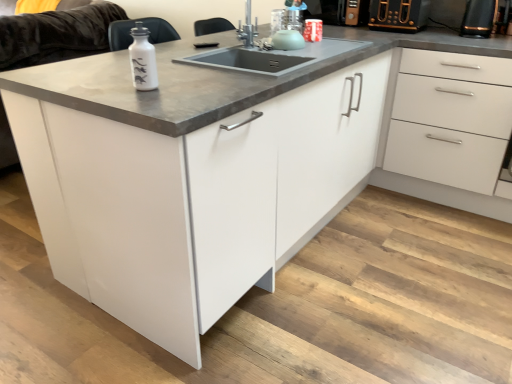
The width and height of the screenshot is (512, 384). What do you see at coordinates (194, 198) in the screenshot? I see `white glossy cabinet at center` at bounding box center [194, 198].

In order to face white glossy bottle at upper left, should I rotate leftwards or rightwards?

You should rotate left by 15.250 degrees.

What is the approximate height of white glossy bottle at upper left?

7.27 inches.

The width and height of the screenshot is (512, 384). I want to click on black plastic toaster at upper right, which is counted as the 2th appliance, starting from the left, so click(x=478, y=18).

In the scene shown: From a real-world perspective, which object rests below the other?

white glossy drawer at right is physically lower.

Based on the photo, considering the sizes of objects white glossy bottle at upper left and white glossy drawer at right in the image provided, who is smaller, white glossy bottle at upper left or white glossy drawer at right?

Smaller between the two is white glossy bottle at upper left.

Is white glossy bottle at upper left situated inside white glossy drawer at right or outside?

white glossy bottle at upper left is outside white glossy drawer at right.

Could you tell me if white glossy bottle at upper left is turned towards white glossy drawer at right?

No, white glossy bottle at upper left does not turn towards white glossy drawer at right.

Considering the relative sizes of white matte couch at upper left and satin nickel faucet at upper center in the image provided, is white matte couch at upper left thinner than satin nickel faucet at upper center?

In fact, white matte couch at upper left might be wider than satin nickel faucet at upper center.

Identify the location of faucet that appears below the white matte couch at upper left (from the image's perspective). Image resolution: width=512 pixels, height=384 pixels. (247, 28).

Is white matte couch at upper left facing towards satin nickel faucet at upper center?

No, white matte couch at upper left is not turned towards satin nickel faucet at upper center.

Consider the image. Who is bigger, white glossy cabinet at center or black plastic toaster at upper right, placed as the 1th appliance when sorted from left to right?

Bigger between the two is white glossy cabinet at center.

From the picture: Would you say white glossy cabinet at center contains black plastic toaster at upper right, placed as the 1th appliance when sorted from left to right?

Actually, black plastic toaster at upper right, placed as the 1th appliance when sorted from left to right, is outside white glossy cabinet at center.

From the image's perspective, between white glossy cabinet at center and black plastic toaster at upper right, which appears as the 2th appliance when viewed from the right, who is located below?

white glossy cabinet at center appears lower in the image.

Which is in front, black plastic toaster at upper right, the 1th appliance when ordered from right to left, or white glossy bottle at upper left?

white glossy bottle at upper left.

From a real-world perspective, is black plastic toaster at upper right, the 1th appliance when ordered from right to left, on white glossy bottle at upper left?

No, from a real-world perspective, black plastic toaster at upper right, the 1th appliance when ordered from right to left, is not on top of white glossy bottle at upper left.

Can you confirm if black plastic toaster at upper right, which is counted as the 2th appliance, starting from the left, is bigger than white glossy bottle at upper left?

Indeed, black plastic toaster at upper right, which is counted as the 2th appliance, starting from the left, has a larger size compared to white glossy bottle at upper left.

Is black plastic toaster at upper right, which is counted as the 2th appliance, starting from the left, completely or partially outside of white glossy bottle at upper left?

black plastic toaster at upper right, which is counted as the 2th appliance, starting from the left, is positioned outside white glossy bottle at upper left.

From the image's perspective, which is above, white matte couch at upper left or white glossy bottle at upper left?

white matte couch at upper left, from the image's perspective.

How many degrees apart are the facing directions of white matte couch at upper left and white glossy bottle at upper left?

The facing directions of white matte couch at upper left and white glossy bottle at upper left are 180 degrees apart.

Based on the photo, looking at their sizes, would you say white matte couch at upper left is wider or thinner than white glossy bottle at upper left?

In the image, white matte couch at upper left appears to be wider than white glossy bottle at upper left.

Who is more distant, white matte couch at upper left or white glossy bottle at upper left?

Positioned behind is white matte couch at upper left.

Who is taller, satin nickel faucet at upper center or black plastic toaster at upper right, which appears as the 2th appliance when viewed from the right?

satin nickel faucet at upper center is taller.

Is satin nickel faucet at upper center turned away from black plastic toaster at upper right, placed as the 1th appliance when sorted from left to right?

That's not correct — satin nickel faucet at upper center is not looking away from black plastic toaster at upper right, placed as the 1th appliance when sorted from left to right.

Would you consider satin nickel faucet at upper center to be distant from black plastic toaster at upper right, which appears as the 2th appliance when viewed from the right?

No, there isn't a large distance between satin nickel faucet at upper center and black plastic toaster at upper right, which appears as the 2th appliance when viewed from the right.

Is satin nickel faucet at upper center situated inside black plastic toaster at upper right, placed as the 1th appliance when sorted from left to right, or outside?

The correct answer is: outside.

At what (x,y) coordinates should I click in order to perform the action: click on cabinetry below the satin nickel faucet at upper center (from a real-world perspective). Please return your answer as a coordinate pair (x, y). The width and height of the screenshot is (512, 384). Looking at the image, I should click on (194, 198).

Which is in front, satin nickel faucet at upper center or white glossy cabinet at center?

white glossy cabinet at center is more forward.

Based on the photo, which is correct: satin nickel faucet at upper center is inside white glossy cabinet at center, or outside of it?

satin nickel faucet at upper center is not inside white glossy cabinet at center, it's outside.

Can you tell me how much satin nickel faucet at upper center and white glossy cabinet at center differ in facing direction?

They differ by 51.4 degrees in their facing directions.

I want to click on drawer located on the right of white glossy bottle at upper left, so click(450, 119).

Locate an element on the screen. faucet that appears above the white matte couch at upper left (from a real-world perspective) is located at coordinates (247, 28).

From the image, which object appears to be nearer to satin nickel faucet at upper center, white matte couch at upper left or white glossy cabinet at center?

white glossy cabinet at center is closer to satin nickel faucet at upper center.

Looking at this image, estimate the real-world distances between objects in this image. Which object is closer to white matte couch at upper left, white glossy bottle at upper left or black plastic toaster at upper right, placed as the 1th appliance when sorted from left to right?

white glossy bottle at upper left.

Looking at the image, which one is located further to white glossy drawer at right, white matte couch at upper left or satin nickel faucet at upper center?

white matte couch at upper left is further to white glossy drawer at right.

Which object lies further to the anchor point satin nickel faucet at upper center, white glossy drawer at right or white glossy bottle at upper left?

white glossy drawer at right.

Based on their spatial positions, is white matte couch at upper left or satin nickel faucet at upper center closer to black plastic toaster at upper right, the 1th appliance when ordered from right to left?

Based on the image, satin nickel faucet at upper center appears to be nearer to black plastic toaster at upper right, the 1th appliance when ordered from right to left.

Considering their positions, is white glossy bottle at upper left positioned closer to white matte couch at upper left than white glossy drawer at right?

Among the two, white glossy bottle at upper left is located nearer to white matte couch at upper left.

Estimate the real-world distances between objects in this image. Which object is closer to white glossy drawer at right, black plastic toaster at upper right, placed as the 1th appliance when sorted from left to right, or black plastic toaster at upper right, which is counted as the 2th appliance, starting from the left?

black plastic toaster at upper right, which is counted as the 2th appliance, starting from the left, is positioned closer to the anchor white glossy drawer at right.

Estimate the real-world distances between objects in this image. Which object is closer to white glossy drawer at right, white glossy cabinet at center or black plastic toaster at upper right, which is counted as the 2th appliance, starting from the left?

black plastic toaster at upper right, which is counted as the 2th appliance, starting from the left, lies closer to white glossy drawer at right than the other object.

The height and width of the screenshot is (384, 512). Identify the location of cabinetry between white matte couch at upper left and white glossy drawer at right. (194, 198).

The width and height of the screenshot is (512, 384). I want to click on faucet between white glossy bottle at upper left and white glossy drawer at right from left to right, so click(x=247, y=28).

Locate an element on the screen. faucet between white glossy bottle at upper left and black plastic toaster at upper right, which appears as the 2th appliance when viewed from the right, from left to right is located at coordinates (247, 28).

What are the coordinates of `cabinetry situated between satin nickel faucet at upper center and white glossy drawer at right from left to right` in the screenshot? It's located at (194, 198).